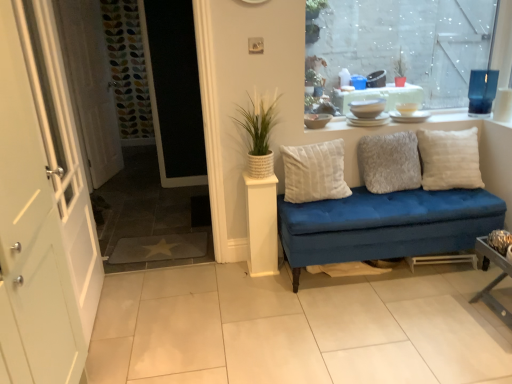
Describe the element at coordinates (314, 172) in the screenshot. I see `white cotton cushion at center, the 3th pillow viewed from the right` at that location.

This screenshot has width=512, height=384. Identify the location of white matte pedestal at center, which is the 2th table in right-to-left order. (262, 225).

Find the location of a particular element. textured gray pillow at center, which is the 2th pillow from right to left is located at coordinates (389, 162).

What do you see at coordinates (408, 42) in the screenshot? Image resolution: width=512 pixels, height=384 pixels. I see `transparent glass window at upper right` at bounding box center [408, 42].

Find the location of a particular element. white textured screen door at left is located at coordinates (90, 85).

What are the coordinates of `metallic silver table at lower right, which ranks as the second table in left-to-right order` in the screenshot? It's located at (494, 279).

Where is `white cotton cushion at center, the 3th pillow viewed from the right`? The image size is (512, 384). white cotton cushion at center, the 3th pillow viewed from the right is located at coordinates (314, 172).

From the image's perspective, which is above, white textured pot at center or white tile at center?

white textured pot at center, from the image's perspective.

The width and height of the screenshot is (512, 384). Find the location of `tile in front of the white textured pot at center`. tile in front of the white textured pot at center is located at coordinates (297, 328).

Would you say white textured pot at center is to the left or to the right of white tile at center in the picture?

white textured pot at center is positioned on white tile at center's left side.

Choose the correct answer: Is transparent glass window at upper right inside white painted wood door at left or outside it?

transparent glass window at upper right cannot be found inside white painted wood door at left.

Is transparent glass window at upper right at the left side of white painted wood door at left?

No.

From the image's perspective, is transparent glass window at upper right under white painted wood door at left?

Incorrect, from the image's perspective, transparent glass window at upper right is higher than white painted wood door at left.

The height and width of the screenshot is (384, 512). What are the coordinates of `door below the transparent glass window at upper right (from a real-world perspective)` in the screenshot? It's located at (42, 208).

From a real-world perspective, between white textured door at left and transparent glass window at upper right, who is vertically lower?

white textured door at left is physically lower.

Considering the sizes of white textured door at left and transparent glass window at upper right in the image, is white textured door at left bigger or smaller than transparent glass window at upper right?

Clearly, white textured door at left is larger in size than transparent glass window at upper right.

Who is shorter, white textured door at left or transparent glass window at upper right?

With less height is transparent glass window at upper right.

Is white tile at center bigger than white matte pedestal at center, which is the 2th table in right-to-left order?

Yes, white tile at center is bigger than white matte pedestal at center, which is the 2th table in right-to-left order.

Considering the points (347, 277) and (251, 256), which point is in front, point (347, 277) or point (251, 256)?

The point (347, 277) is more forward.

Considering the relative sizes of white tile at center and white matte pedestal at center, placed as the 1th table when sorted from back to front, in the image provided, is white tile at center taller than white matte pedestal at center, placed as the 1th table when sorted from back to front,?

No.

From a real-world perspective, is white tile at center positioned over white matte pedestal at center, which is the 2th table in right-to-left order, based on gravity?

No, from a real-world perspective, white tile at center is not above white matte pedestal at center, which is the 2th table in right-to-left order.

Is metallic silver table at lower right, which ranks as the second table in back-to-front order, oriented away from white painted wood door at left?

That's not correct — metallic silver table at lower right, which ranks as the second table in back-to-front order, is not looking away from white painted wood door at left.

Is point (481, 299) more distant than point (73, 375)?

Yes, it is behind point (73, 375).

Does metallic silver table at lower right, which ranks as the second table in left-to-right order, lie behind white painted wood door at left?

That is True.

From a real-world perspective, who is located lower, metallic silver table at lower right, the first table viewed from the front, or white painted wood door at left?

In real-world perspective, metallic silver table at lower right, the first table viewed from the front, is lower.

Between white cotton cushion at center, the 3th pillow viewed from the right, and metallic silver table at lower right, which ranks as the 1th table in right-to-left order, which one has more height?

metallic silver table at lower right, which ranks as the 1th table in right-to-left order, is taller.

Is point (286, 195) positioned before point (508, 267)?

No.

Would you say white cotton cushion at center, marked as the first pillow in a left-to-right arrangement, is a long distance from metallic silver table at lower right, which ranks as the second table in back-to-front order?

white cotton cushion at center, marked as the first pillow in a left-to-right arrangement, is far away from metallic silver table at lower right, which ranks as the second table in back-to-front order.

How far apart are white cotton cushion at center, the 3th pillow viewed from the right, and white textured screen door at left?

The distance of white cotton cushion at center, the 3th pillow viewed from the right, from white textured screen door at left is 7.97 feet.

Based on their positions, is white cotton cushion at center, the 3th pillow viewed from the right, located to the left or right of white textured screen door at left?

white cotton cushion at center, the 3th pillow viewed from the right, is to the right of white textured screen door at left.

From the image's perspective, which pillow is the 3rd one below the white textured screen door at left? Please provide its 2D coordinates.

[(314, 172)]

Which of these two, white cotton cushion at center, the 3th pillow viewed from the right, or white textured screen door at left, stands shorter?

Standing shorter between the two is white cotton cushion at center, the 3th pillow viewed from the right.

Locate an element on the screen. The height and width of the screenshot is (384, 512). tile below the white textured pot at center (from a real-world perspective) is located at coordinates (297, 328).

You are a GUI agent. You are given a task and a screenshot of the screen. Output one action in this format:
    pyautogui.click(x=<x>, y=<y>)
    Task: Click on the window above the white painted wood door at left (from the image's perspective)
    The image size is (512, 384).
    Given the screenshot: What is the action you would take?
    pyautogui.click(x=408, y=42)

Based on their spatial positions, is white matte pedestal at center, marked as the first table in a left-to-right arrangement, or white painted wood door at left closer to metallic silver table at lower right, the first table viewed from the front?

white matte pedestal at center, marked as the first table in a left-to-right arrangement, is closer to metallic silver table at lower right, the first table viewed from the front.

Which object lies nearer to the anchor point white textured screen door at left, white soft cushion at right, which appears as the third pillow when viewed from the left, or metallic silver table at lower right, the first table viewed from the front?

white soft cushion at right, which appears as the third pillow when viewed from the left.

From the image, which object appears to be nearer to white textured door at left, white tile at center or white textured screen door at left?

The object closer to white textured door at left is white textured screen door at left.

Based on their spatial positions, is white textured screen door at left or white textured door at left closer to textured gray pillow at center, which is the 2th pillow from right to left?

white textured door at left is closer to textured gray pillow at center, which is the 2th pillow from right to left.

Based on their spatial positions, is white ceramic dishes at upper center or white painted wood door at left closer to metallic silver table at lower right, which ranks as the second table in back-to-front order?

white ceramic dishes at upper center is closer to metallic silver table at lower right, which ranks as the second table in back-to-front order.

Based on their spatial positions, is transparent glass window at upper right or white textured pot at center closer to white ceramic dishes at upper center?

The object closer to white ceramic dishes at upper center is white textured pot at center.

When comparing their distances from white textured screen door at left, does white painted wood door at left or textured gray pillow at center, the second pillow when ordered from left to right, seem further?

textured gray pillow at center, the second pillow when ordered from left to right, is positioned further to the anchor white textured screen door at left.

From the image, which object appears to be farther from white painted wood door at left, white textured door at left or textured gray pillow at center, the second pillow when ordered from left to right?

textured gray pillow at center, the second pillow when ordered from left to right.

What are the coordinates of `plant situated between white painted wood door at left and white soft cushion at right, marked as the first pillow in a right-to-left arrangement, from left to right` in the screenshot? It's located at (259, 122).

In order to click on window sill between transparent glass window at upper right and white cotton cushion at center, the 3th pillow viewed from the right, in the vertical direction in this screenshot , I will do `click(452, 119)`.

You are a GUI agent. You are given a task and a screenshot of the screen. Output one action in this format:
    pyautogui.click(x=<x>, y=<y>)
    Task: Click on the window sill located between white textured pot at center and transparent glass window at upper right in the left-right direction
    Image resolution: width=512 pixels, height=384 pixels.
    Given the screenshot: What is the action you would take?
    click(x=452, y=119)

You are a GUI agent. You are given a task and a screenshot of the screen. Output one action in this format:
    pyautogui.click(x=<x>, y=<y>)
    Task: Click on the plant between white textured door at left and white matte pedestal at center, marked as the first table in a left-to-right arrangement, in the horizontal direction
    
    Given the screenshot: What is the action you would take?
    pyautogui.click(x=259, y=122)